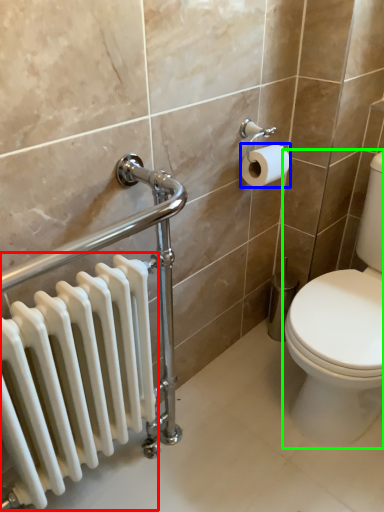
Question: Based on their relative distances, which object is farther from radiator (highlighted by a red box)? Choose from toilet paper (highlighted by a blue box) and toilet (highlighted by a green box).

Choices:
 (A) toilet paper
 (B) toilet

Answer: (A)